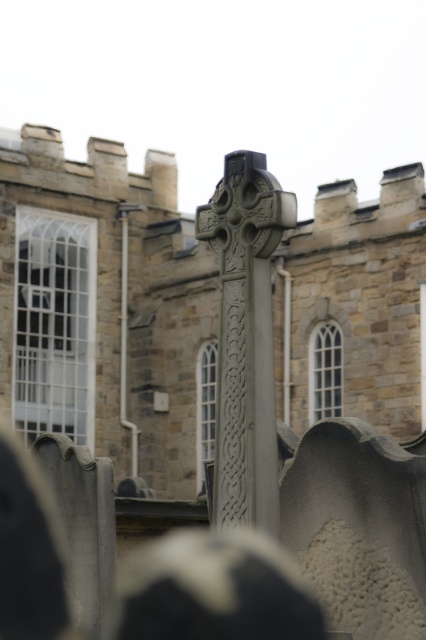
Between point (26, 253) and point (253, 486), which one is positioned behind?

The point (26, 253) is behind.

Which is more to the left, gray stone church at center or gray stone cross at center?

gray stone church at center is more to the left.

Image resolution: width=426 pixels, height=640 pixels. I want to click on gray stone church at center, so click(106, 308).

Find the location of `gray stone church at center`. gray stone church at center is located at coordinates click(106, 308).